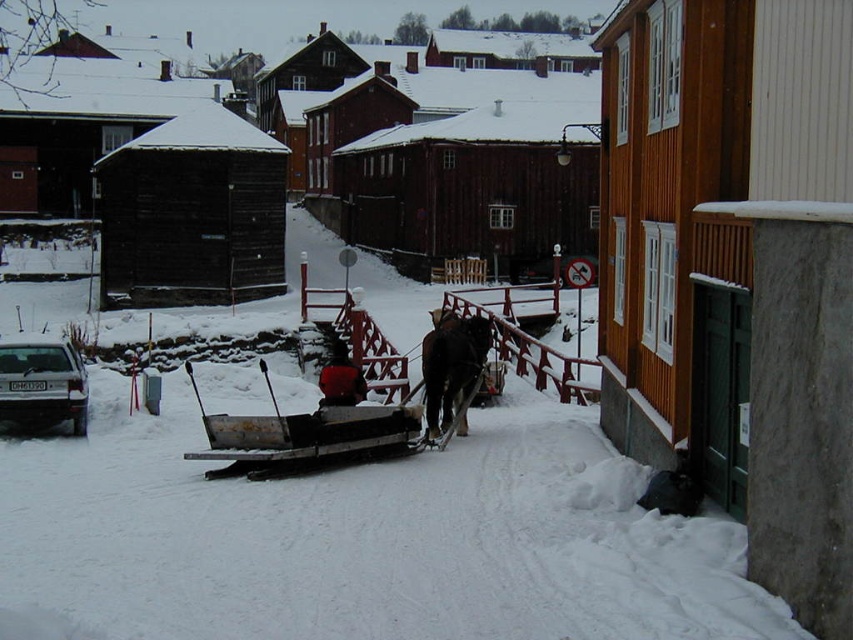
In the scene shown: How much distance is there between metallic silver sled at center and dark brown glossy horse at center?

metallic silver sled at center and dark brown glossy horse at center are 3.76 meters apart from each other.

Which is behind, point (296, 416) or point (476, 323)?

The point (476, 323) is behind.

This screenshot has width=853, height=640. What are the coordinates of `metallic silver sled at center` in the screenshot? It's located at (300, 433).

Is point (442, 420) positioned behind point (318, 372)?

That is False.

Does dark brown glossy horse at center have a smaller size compared to smooth red sled at center?

Correct, dark brown glossy horse at center occupies less space than smooth red sled at center.

Does point (479, 324) come in front of point (340, 362)?

No.

Find the location of a particular element. This screenshot has height=640, width=853. dark brown glossy horse at center is located at coordinates (451, 365).

Which is behind, point (349, 432) or point (360, 397)?

The point (360, 397) is behind.

Is metallic silver sled at center shorter than smooth red sled at center?

Yes.

Is point (403, 408) closer to viewer compared to point (339, 397)?

That is False.

At what (x,y) coordinates should I click in order to perform the action: click on metallic silver sled at center. Please return your answer as a coordinate pair (x, y). Image resolution: width=853 pixels, height=640 pixels. Looking at the image, I should click on (300, 433).